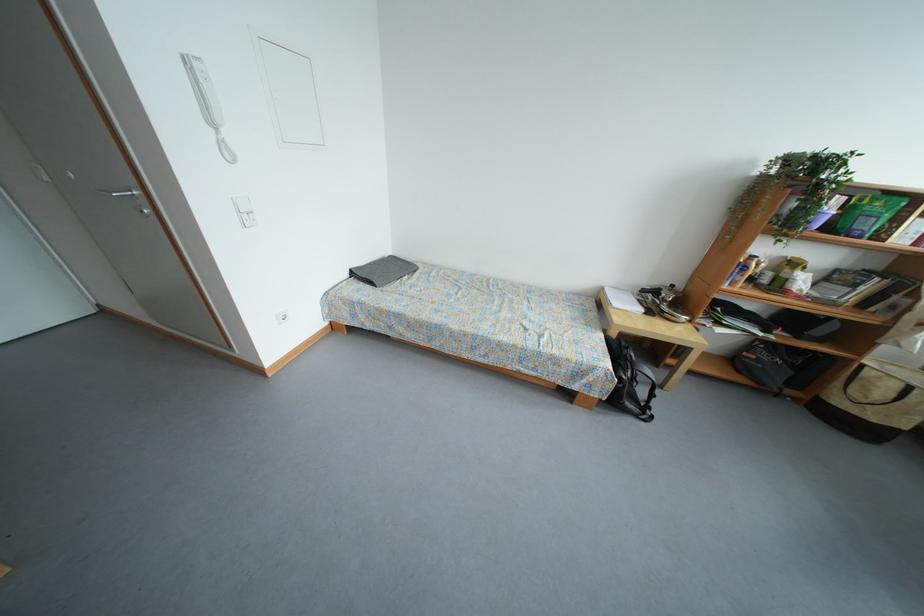
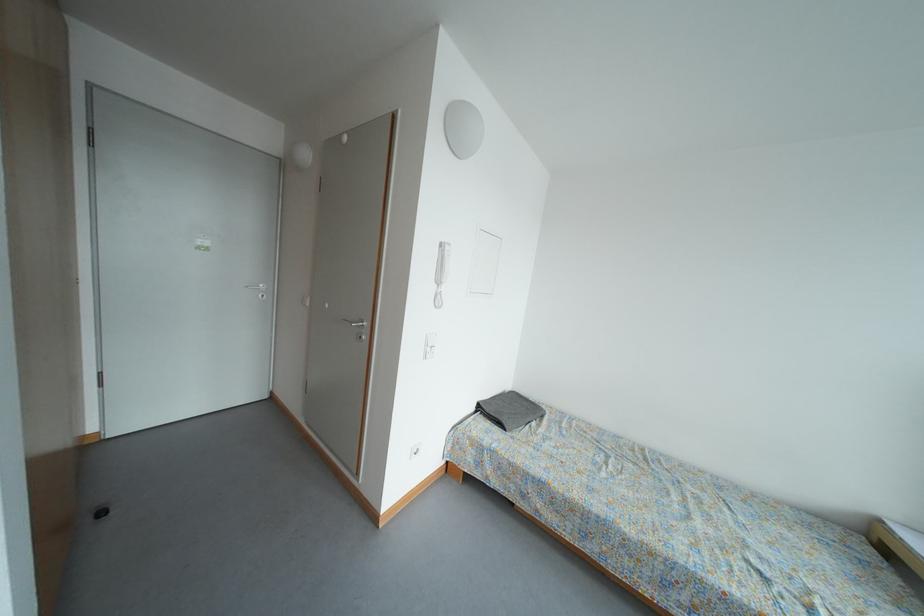
Based on the continuous images, in which direction is the camera rotating?

The rotation direction of the camera is left-up.